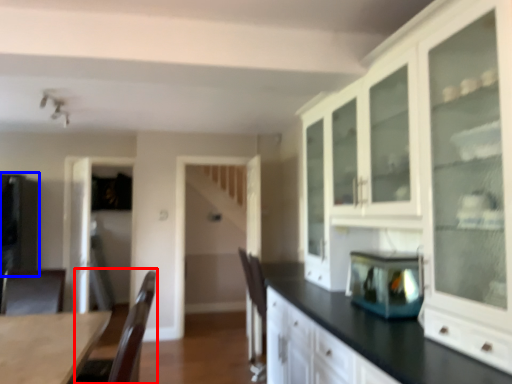
Question: Among these objects, which one is farthest to the camera, armchair (highlighted by a red box) or appliance (highlighted by a blue box)?

Choices:
 (A) armchair
 (B) appliance

Answer: (B)